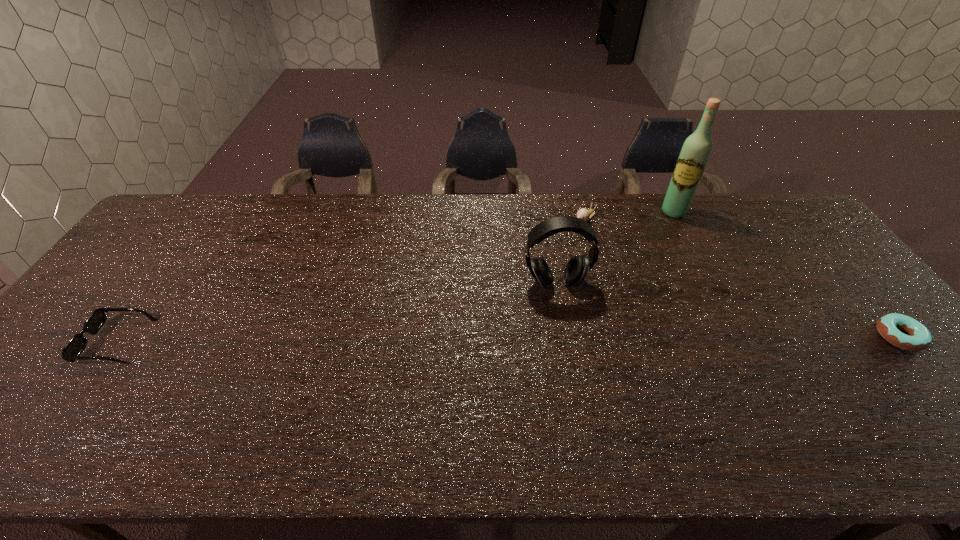
Where is `free space at the far right corner of the desktop`? free space at the far right corner of the desktop is located at coordinates (756, 201).

Find the location of a particular element. This screenshot has width=960, height=540. free space between the rightmost object and the fourth object from left to right is located at coordinates (786, 274).

The height and width of the screenshot is (540, 960). In order to click on vacant region between the earphone and the doughnut in this screenshot , I will do `click(728, 309)`.

This screenshot has height=540, width=960. I want to click on free space between the leftmost object and the doughnut, so click(508, 339).

Locate an element on the screen. This screenshot has width=960, height=540. unoccupied position between the shortest object and the escargot is located at coordinates (741, 278).

Where is `vacant region between the earphone and the leftmost object`? This screenshot has height=540, width=960. vacant region between the earphone and the leftmost object is located at coordinates (337, 312).

Locate an element on the screen. This screenshot has height=540, width=960. vacant area between the tallest object and the shortest object is located at coordinates (786, 274).

Locate an element on the screen. free space between the escargot and the rightmost object is located at coordinates (741, 278).

Where is `free space between the third farthest object and the tallest object`? This screenshot has width=960, height=540. free space between the third farthest object and the tallest object is located at coordinates (614, 247).

Locate an element on the screen. This screenshot has height=540, width=960. vacant space that's between the doughnut and the escargot is located at coordinates (741, 278).